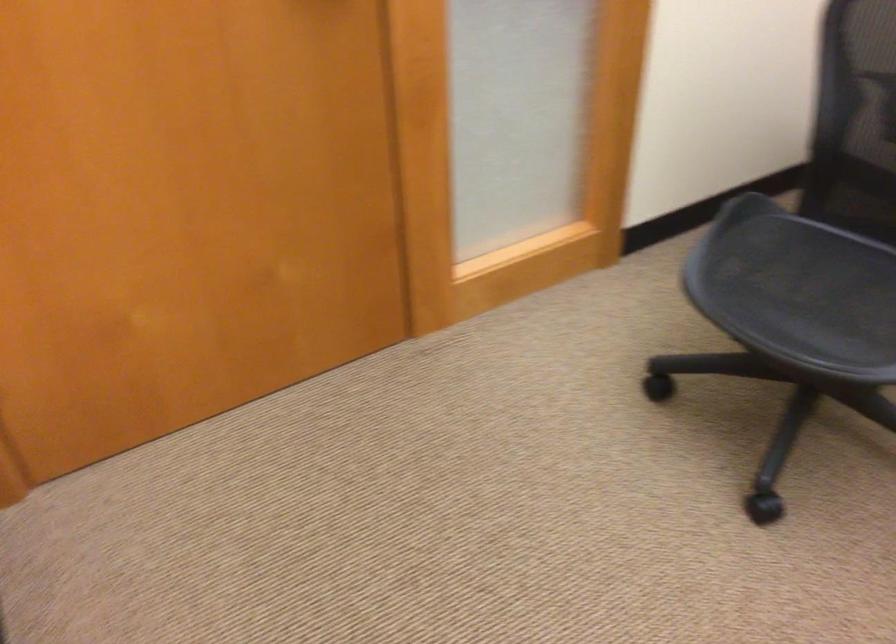
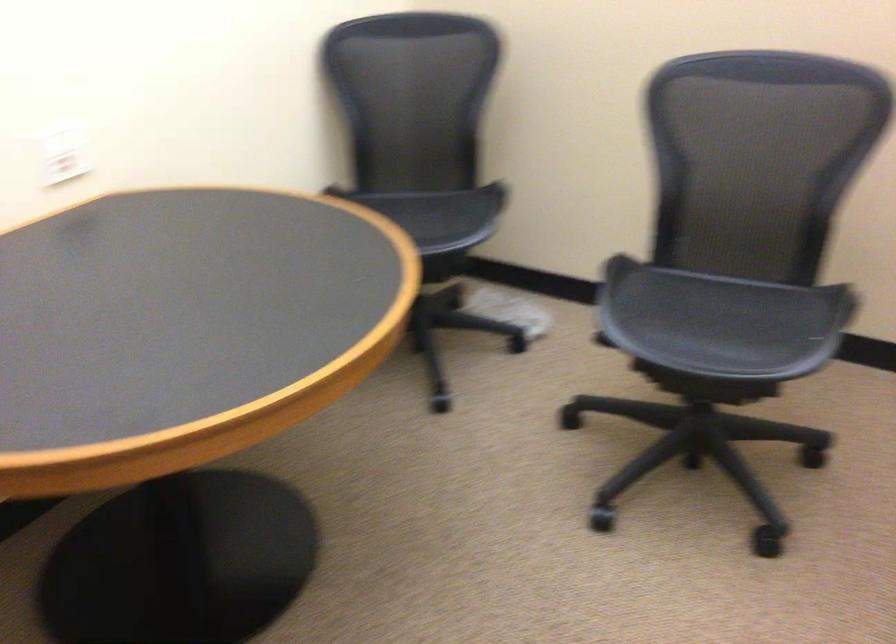
Based on the photo, based on the continuous images, in which direction is the camera rotating?

The camera's rotation is toward right-down.